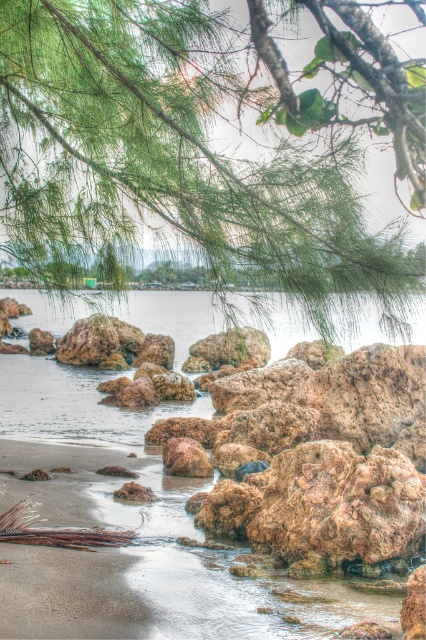
Between point (331, 83) and point (319, 625), which one is positioned in front?

Point (331, 83) is in front.

At what (x,y) coordinates should I click in order to perform the action: click on green textured branch at upper center. Please return your answer as a coordinate pair (x, y). The image size is (426, 640). Looking at the image, I should click on (203, 141).

Locate an element on the screen. The height and width of the screenshot is (640, 426). green textured branch at upper center is located at coordinates tap(203, 141).